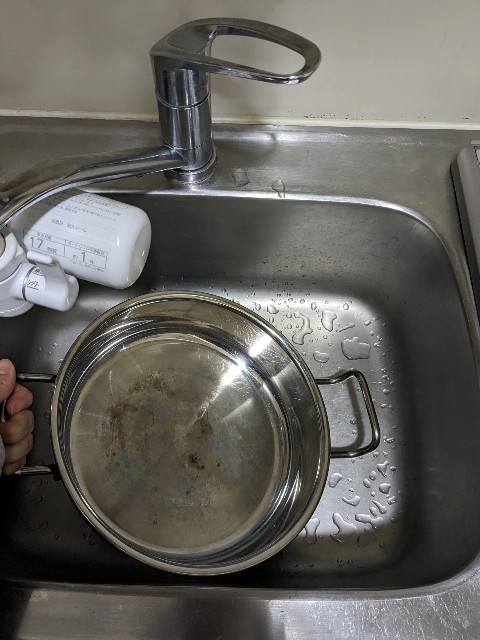
The image size is (480, 640). In order to click on sink in this screenshot , I will do `click(346, 266)`.